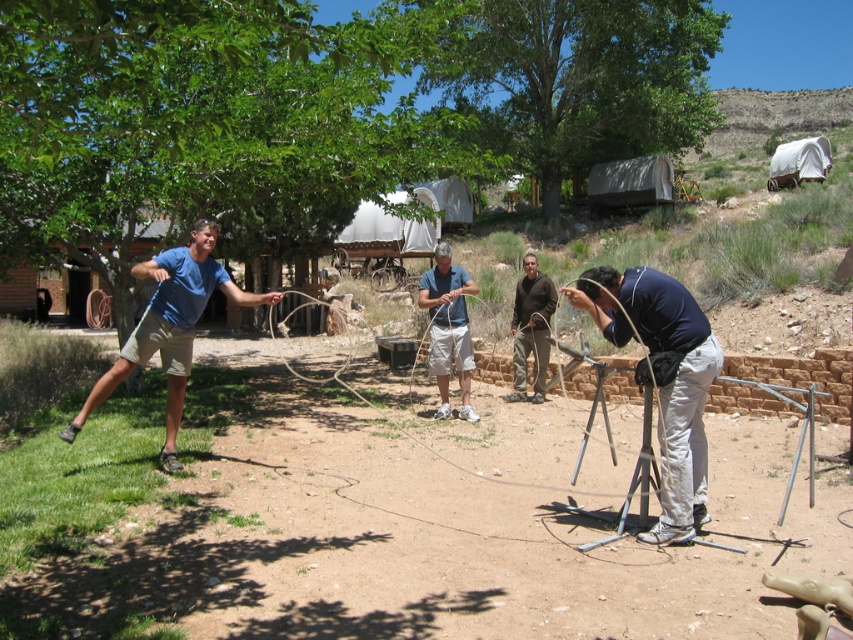
Question: Which point is closer to the camera?

Choices:
 (A) dark blue fabric at center
 (B) brown cotton pants at center

Answer: (A)

Question: Can you confirm if blue cotton shirt at left is positioned to the left of brown cotton pants at center?

Choices:
 (A) yes
 (B) no

Answer: (A)

Question: Estimate the real-world distances between objects in this image. Which object is closer to the matte blue shirt at center?

Choices:
 (A) blue cotton shirt at left
 (B) brown cotton pants at center

Answer: (B)

Question: Based on their relative distances, which object is farther from the blue cotton shirt at left?

Choices:
 (A) brown cotton pants at center
 (B) matte blue shirt at center

Answer: (A)

Question: Considering the relative positions of blue cotton shirt at left and matte blue shirt at center in the image provided, where is blue cotton shirt at left located with respect to matte blue shirt at center?

Choices:
 (A) right
 (B) left

Answer: (B)

Question: Considering the relative positions of dark blue fabric at center and brown cotton pants at center in the image provided, where is dark blue fabric at center located with respect to brown cotton pants at center?

Choices:
 (A) right
 (B) left

Answer: (A)